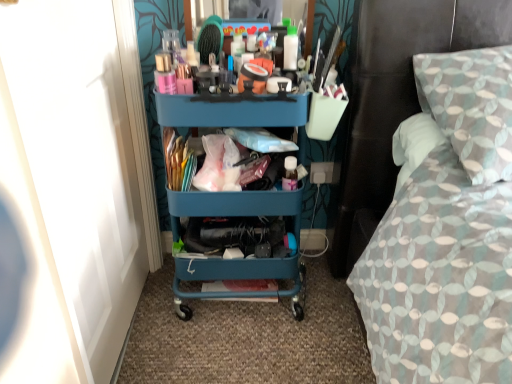
This screenshot has width=512, height=384. Find the location of `teal plastic cart at center`. teal plastic cart at center is located at coordinates (233, 112).

Where is `textured fabric bed at right`? textured fabric bed at right is located at coordinates (448, 235).

Find the location of a particular element. The height and width of the screenshot is (384, 512). teal plastic cart at center is located at coordinates (233, 112).

Does textured fabric bed at right appear on the left side of teal plastic cart at center?

Incorrect, textured fabric bed at right is not on the left side of teal plastic cart at center.

Is point (435, 280) positioned in front of point (254, 274)?

Yes, point (435, 280) is closer to viewer.

Who is bigger, textured fabric bed at right or teal plastic cart at center?

Bigger between the two is textured fabric bed at right.

From a real-world perspective, is white plastic power outlet at lower right located higher than textured fabric bed at right?

Actually, white plastic power outlet at lower right is physically below textured fabric bed at right in the real world.

What's the angular difference between white plastic power outlet at lower right and textured fabric bed at right's facing directions?

1.77 degrees separate the facing orientations of white plastic power outlet at lower right and textured fabric bed at right.

The height and width of the screenshot is (384, 512). In order to click on power outlet beneath the textured fabric bed at right (from a real-world perspective) in this screenshot , I will do `click(321, 172)`.

Considering the sizes of objects white plastic power outlet at lower right and textured fabric bed at right in the image provided, who is shorter, white plastic power outlet at lower right or textured fabric bed at right?

white plastic power outlet at lower right.

Can you confirm if teal plastic cart at center is bigger than textured fabric bed at right?

No, teal plastic cart at center is not bigger than textured fabric bed at right.

Is teal plastic cart at center located outside textured fabric bed at right?

That's correct, teal plastic cart at center is outside of textured fabric bed at right.

Is teal plastic cart at center aimed at textured fabric bed at right?

No, teal plastic cart at center is not oriented towards textured fabric bed at right.

Which is more to the right, teal plastic cart at center or textured fabric bed at right?

textured fabric bed at right.

Measure the distance between white plastic power outlet at lower right and teal plastic cart at center.

white plastic power outlet at lower right and teal plastic cart at center are 48.28 centimeters apart.

Is white plastic power outlet at lower right aimed at teal plastic cart at center?

No, white plastic power outlet at lower right is not facing towards teal plastic cart at center.

Is white plastic power outlet at lower right at the right side of teal plastic cart at center?

Yes, white plastic power outlet at lower right is to the right of teal plastic cart at center.

From a real-world perspective, is white plastic power outlet at lower right located higher than teal plastic cart at center?

No, from a real-world perspective, white plastic power outlet at lower right is not on top of teal plastic cart at center.

From the picture: Does textured fabric bed at right have a greater width compared to white plastic power outlet at lower right?

Indeed, textured fabric bed at right has a greater width compared to white plastic power outlet at lower right.

Choose the correct answer: Is textured fabric bed at right inside white plastic power outlet at lower right or outside it?

textured fabric bed at right cannot be found inside white plastic power outlet at lower right.

Considering the points (448, 143) and (316, 182), which point is behind, point (448, 143) or point (316, 182)?

Positioned behind is point (316, 182).

How different are the orientations of teal plastic cart at center and white plastic power outlet at lower right in degrees?

They differ by 0.164 degrees in their facing directions.

Would you say white plastic power outlet at lower right is part of teal plastic cart at center's contents?

No, white plastic power outlet at lower right is not inside teal plastic cart at center.

How much distance is there between teal plastic cart at center and white plastic power outlet at lower right?

A distance of 19.01 inches exists between teal plastic cart at center and white plastic power outlet at lower right.

Which is more to the right, teal plastic cart at center or white plastic power outlet at lower right?

From the viewer's perspective, white plastic power outlet at lower right appears more on the right side.

This screenshot has height=384, width=512. Find the location of `bed above the teal plastic cart at center (from the image's perspective)`. bed above the teal plastic cart at center (from the image's perspective) is located at coordinates click(x=448, y=235).

Where is `bed that is on the right side of white plastic power outlet at lower right`? bed that is on the right side of white plastic power outlet at lower right is located at coordinates (448, 235).

Estimate the real-world distances between objects in this image. Which object is further from white plastic power outlet at lower right, teal plastic cart at center or textured fabric bed at right?

The object further to white plastic power outlet at lower right is textured fabric bed at right.

Which object lies nearer to the anchor point textured fabric bed at right, teal plastic cart at center or white plastic power outlet at lower right?

Among the two, teal plastic cart at center is located nearer to textured fabric bed at right.

Consider the image. Based on their spatial positions, is textured fabric bed at right or white plastic power outlet at lower right further from teal plastic cart at center?

white plastic power outlet at lower right lies further to teal plastic cart at center than the other object.

From the image, which object appears to be nearer to teal plastic cart at center, white plastic power outlet at lower right or textured fabric bed at right?

textured fabric bed at right.

Looking at the image, which one is located closer to white plastic power outlet at lower right, textured fabric bed at right or teal plastic cart at center?

Among the two, teal plastic cart at center is located nearer to white plastic power outlet at lower right.

When comparing their distances from textured fabric bed at right, does white plastic power outlet at lower right or teal plastic cart at center seem closer?

Among the two, teal plastic cart at center is located nearer to textured fabric bed at right.

This screenshot has height=384, width=512. I want to click on desk between textured fabric bed at right and white plastic power outlet at lower right from front to back, so click(233, 112).